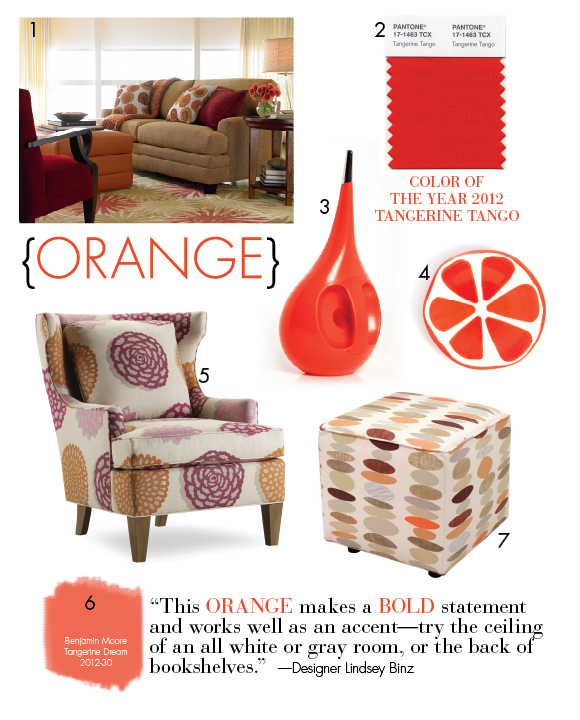
You are a GUI agent. You are given a task and a screenshot of the screen. Output one action in this format:
    pyautogui.click(x=<x>, y=<y>)
    Task: Click on the rug
    The width and height of the screenshot is (580, 720).
    Given the screenshot: What is the action you would take?
    pyautogui.click(x=162, y=199)